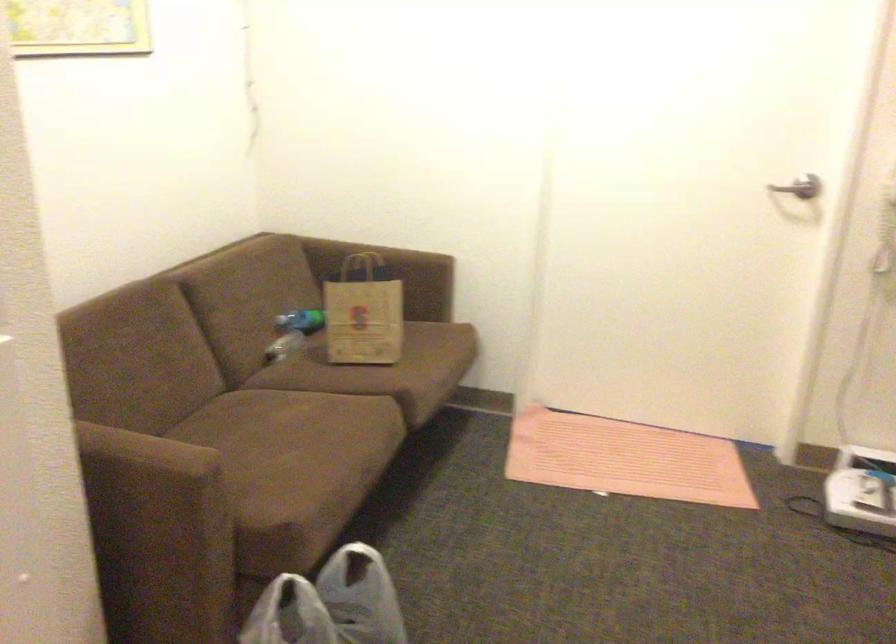
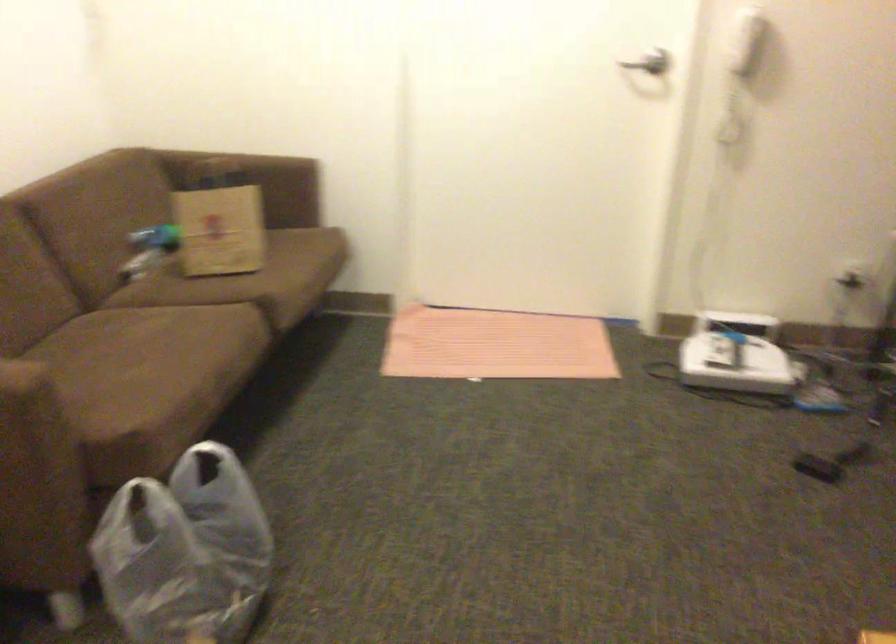
Locate, in the second image, the point that corresponds to pixel 364 323 in the first image.

(220, 230)